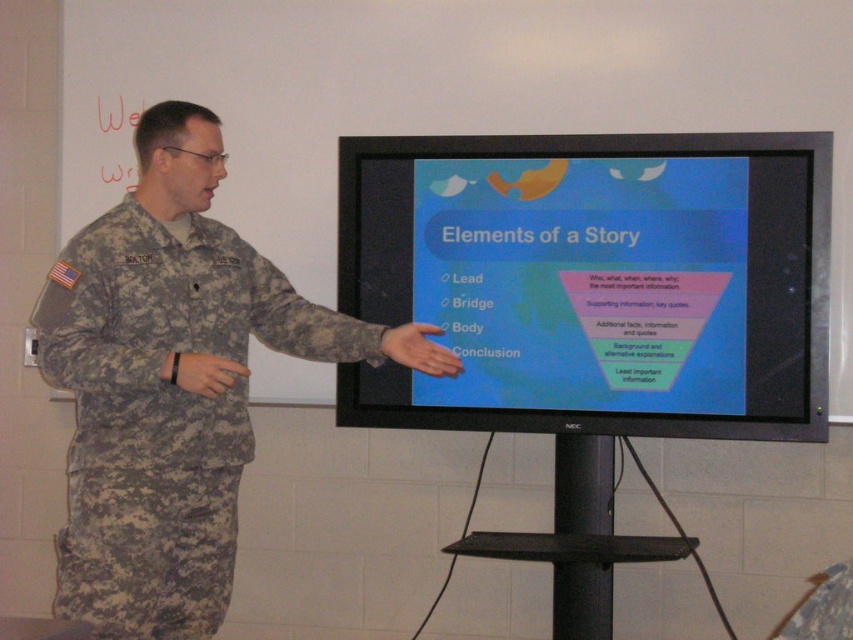
Question: Which of the following is the closest to the observer?

Choices:
 (A) matte black monitor at center
 (B) camouflage fabric uniform at left

Answer: (B)

Question: Observing the image, what is the correct spatial positioning of matte black monitor at center in reference to camouflage fabric uniform at left?

Choices:
 (A) left
 (B) right

Answer: (B)

Question: Where is matte black monitor at center located in relation to camouflage fabric uniform at left in the image?

Choices:
 (A) below
 (B) above

Answer: (B)

Question: Which point is farther to the camera?

Choices:
 (A) (646, 182)
 (B) (138, 328)

Answer: (A)

Question: Is matte black monitor at center to the right of camouflage fabric uniform at left from the viewer's perspective?

Choices:
 (A) no
 (B) yes

Answer: (B)